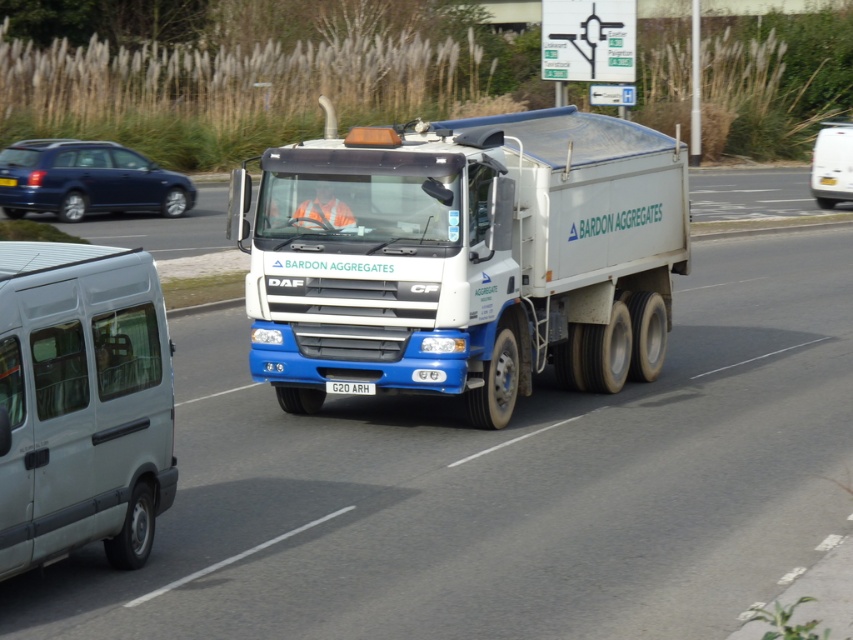
Question: From the image, what is the correct spatial relationship of metallic blue station wagon at left in relation to white plastic license plate at center?

Choices:
 (A) above
 (B) below

Answer: (A)

Question: Is white matte truck at center to the right of white matte van at lower left from the viewer's perspective?

Choices:
 (A) no
 (B) yes

Answer: (B)

Question: Which object is farther from the camera taking this photo?

Choices:
 (A) white matte truck at center
 (B) white matte van at lower left
 (C) white plastic license plate at center
 (D) white matte van at right

Answer: (D)

Question: Which point is farther to the camera?

Choices:
 (A) white matte van at right
 (B) white plastic license plate at center

Answer: (A)

Question: Which of the following is the farthest from the observer?

Choices:
 (A) (97, 161)
 (B) (361, 385)
 (C) (830, 163)
 (D) (618, 173)

Answer: (C)

Question: Is white matte van at right closer to the viewer compared to white plastic license plate at center?

Choices:
 (A) yes
 (B) no

Answer: (B)